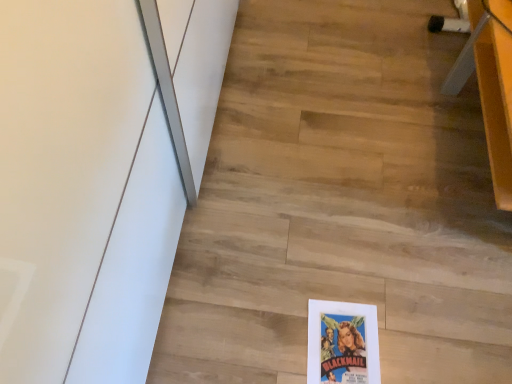
What are the coordinates of `wooden desk at upper right` in the screenshot? It's located at (490, 85).

What do you see at coordinates (490, 85) in the screenshot? This screenshot has height=384, width=512. I see `wooden desk at upper right` at bounding box center [490, 85].

What do you see at coordinates (341, 203) in the screenshot?
I see `wooden floor at center` at bounding box center [341, 203].

At what (x,y) coordinates should I click in order to perform the action: click on wooden floor at center. Please return your answer as a coordinate pair (x, y). The width and height of the screenshot is (512, 384). Looking at the image, I should click on (341, 203).

Image resolution: width=512 pixels, height=384 pixels. Find the location of `wooden desk at upper right`. wooden desk at upper right is located at coordinates [x=490, y=85].

Which object is positioned more to the left, wooden floor at center or wooden desk at upper right?

wooden floor at center.

In the image, is wooden floor at center positioned in front of or behind wooden desk at upper right?

In the image, wooden floor at center appears behind wooden desk at upper right.

Does point (483, 198) lie behind point (484, 65)?

That is True.

From the image's perspective, is wooden floor at center above or below wooden desk at upper right?

From the image's perspective, wooden floor at center appears below wooden desk at upper right.

From a real-world perspective, which is physically below, wooden floor at center or wooden desk at upper right?

In real-world perspective, wooden floor at center is lower.

Which of these two, wooden floor at center or wooden desk at upper right, is wider?

Wider between the two is wooden floor at center.

Between wooden floor at center and wooden desk at upper right, which one has more height?

With more height is wooden desk at upper right.

Can you confirm if wooden floor at center is bigger than wooden desk at upper right?

No.

Is wooden desk at upper right surrounded by wooden floor at center?

No, wooden floor at center does not contain wooden desk at upper right.

Is wooden floor at center touching wooden desk at upper right?

wooden floor at center is not next to wooden desk at upper right, and they're not touching.

From the picture: Is wooden floor at center turned away from wooden desk at upper right?

wooden floor at center does not have its back to wooden desk at upper right.

The height and width of the screenshot is (384, 512). Identify the location of stair on the left of wooden desk at upper right. (341, 203).

Which object is positioned more to the left, wooden desk at upper right or wooden floor at center?

Positioned to the left is wooden floor at center.

Considering the positions of objects wooden desk at upper right and wooden floor at center in the image provided, who is in front, wooden desk at upper right or wooden floor at center?

Positioned in front is wooden desk at upper right.

Is point (511, 48) closer to viewer compared to point (480, 155)?

Yes, point (511, 48) is in front of point (480, 155).

From the image's perspective, would you say wooden desk at upper right is shown under wooden floor at center?

No, from the image's perspective, wooden desk at upper right is not beneath wooden floor at center.

From a real-world perspective, which is physically below, wooden desk at upper right or wooden floor at center?

From a 3D spatial view, wooden floor at center is below.

Is wooden desk at upper right thinner than wooden floor at center?

Yes, wooden desk at upper right is thinner than wooden floor at center.

Who is taller, wooden desk at upper right or wooden floor at center?

With more height is wooden desk at upper right.

Who is smaller, wooden desk at upper right or wooden floor at center?

wooden floor at center.

Consider the image. Do you think wooden desk at upper right is within wooden floor at center, or outside of it?

wooden desk at upper right is not inside wooden floor at center, it's outside.

Is wooden desk at upper right next to wooden floor at center and touching it?

wooden desk at upper right is not next to wooden floor at center, and they're not touching.

Is wooden desk at upper right facing towards wooden floor at center?

Yes, wooden desk at upper right faces towards wooden floor at center.

Where is `stair behind the wooden desk at upper right`? This screenshot has height=384, width=512. stair behind the wooden desk at upper right is located at coordinates (341, 203).

At what (x,y) coordinates should I click in order to perform the action: click on furniture that appears on the right of wooden floor at center. Please return your answer as a coordinate pair (x, y). This screenshot has width=512, height=384. Looking at the image, I should click on (490, 85).

This screenshot has width=512, height=384. What are the coordinates of `stair on the left of wooden desk at upper right` in the screenshot? It's located at (341, 203).